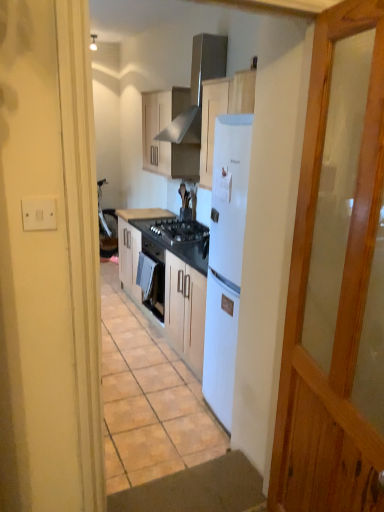
Identify the location of black laminate countertop at center, positioned as the 2th countertop in bottom-to-top order. This screenshot has width=384, height=512. (143, 213).

The image size is (384, 512). Find the location of `black glass gas stove at center`. black glass gas stove at center is located at coordinates (180, 231).

You are a GUI agent. You are given a task and a screenshot of the screen. Output one action in this format:
    pyautogui.click(x=<x>, y=<y>)
    Task: Click on the black laminate countertop at center, positioned as the 2th countertop in bottom-to-top order
    Image resolution: width=384 pixels, height=512 pixels.
    Given the screenshot: What is the action you would take?
    pyautogui.click(x=143, y=213)

Would you consider matte wood cabinets at center to be distant from black granite countertop at center, positioned as the 2th countertop in top-to-bottom order?

No, matte wood cabinets at center is not far from black granite countertop at center, positioned as the 2th countertop in top-to-bottom order.

From the image's perspective, is matte wood cabinets at center on black granite countertop at center, positioned as the 2th countertop in top-to-bottom order?

Yes, from the image's perspective, matte wood cabinets at center is over black granite countertop at center, positioned as the 2th countertop in top-to-bottom order.

Can you tell me how much matte wood cabinets at center and black granite countertop at center, the first countertop when ordered from bottom to top, differ in facing direction?

matte wood cabinets at center and black granite countertop at center, the first countertop when ordered from bottom to top, are facing 1.15 degrees away from each other.

Considering the points (172, 170) and (149, 228), which point is in front, point (172, 170) or point (149, 228)?

The point (172, 170) is closer to the camera.

Considering the sizes of objects black granite countertop at center, the first countertop when ordered from bottom to top, and stainless steel exhaust hood at upper center in the image provided, who is thinner, black granite countertop at center, the first countertop when ordered from bottom to top, or stainless steel exhaust hood at upper center?

Thinner between the two is stainless steel exhaust hood at upper center.

From a real-world perspective, is black granite countertop at center, the first countertop when ordered from bottom to top, on top of stainless steel exhaust hood at upper center?

Actually, black granite countertop at center, the first countertop when ordered from bottom to top, is physically below stainless steel exhaust hood at upper center in the real world.

This screenshot has height=512, width=384. Find the location of `exhaust hood in front of the black granite countertop at center, positioned as the 2th countertop in top-to-bottom order`. exhaust hood in front of the black granite countertop at center, positioned as the 2th countertop in top-to-bottom order is located at coordinates 197,88.

Considering the relative sizes of black granite countertop at center, positioned as the 2th countertop in top-to-bottom order, and stainless steel exhaust hood at upper center in the image provided, is black granite countertop at center, positioned as the 2th countertop in top-to-bottom order, shorter than stainless steel exhaust hood at upper center?

Indeed, black granite countertop at center, positioned as the 2th countertop in top-to-bottom order, has a lesser height compared to stainless steel exhaust hood at upper center.

This screenshot has height=512, width=384. In the image, there is a black laminate countertop at center, positioned as the 2th countertop in bottom-to-top order. In order to click on countertop below it (from a real-world perspective) in this screenshot , I will do `click(176, 237)`.

Is point (156, 209) farther from camera compared to point (135, 218)?

Yes, it is behind point (135, 218).

In the scene shown: Considering the sizes of objects black granite countertop at center, the first countertop when ordered from bottom to top, and black laminate countertop at center, positioned as the 2th countertop in bottom-to-top order, in the image provided, who is bigger, black granite countertop at center, the first countertop when ordered from bottom to top, or black laminate countertop at center, positioned as the 2th countertop in bottom-to-top order,?

black granite countertop at center, the first countertop when ordered from bottom to top.

Is black granite countertop at center, positioned as the 2th countertop in top-to-bottom order, oriented away from black laminate countertop at center, which is counted as the 1th countertop, starting from the top?

No, black granite countertop at center, positioned as the 2th countertop in top-to-bottom order,'s orientation is not away from black laminate countertop at center, which is counted as the 1th countertop, starting from the top.

Does matte wood cabinets at center have a lesser width compared to stainless steel exhaust hood at upper center?

Yes, matte wood cabinets at center is thinner than stainless steel exhaust hood at upper center.

From the image's perspective, which is above, matte wood cabinets at center or stainless steel exhaust hood at upper center?

stainless steel exhaust hood at upper center is shown above in the image.

Is stainless steel exhaust hood at upper center at the back of matte wood cabinets at center?

matte wood cabinets at center does not have its back to stainless steel exhaust hood at upper center.

Is the position of matte wood cabinets at center less distant than that of stainless steel exhaust hood at upper center?

No, it is not.

Looking at this image, considering the positions of objects black granite countertop at center, the first countertop when ordered from bottom to top, and white plastic switch at upper left in the image provided, who is more to the left, black granite countertop at center, the first countertop when ordered from bottom to top, or white plastic switch at upper left?

white plastic switch at upper left.

In terms of height, does black granite countertop at center, the first countertop when ordered from bottom to top, look taller or shorter compared to white plastic switch at upper left?

black granite countertop at center, the first countertop when ordered from bottom to top, is taller than white plastic switch at upper left.

Is white plastic switch at upper left at the back of black granite countertop at center, positioned as the 2th countertop in top-to-bottom order?

That's not correct — black granite countertop at center, positioned as the 2th countertop in top-to-bottom order, is not looking away from white plastic switch at upper left.

How distant is black granite countertop at center, positioned as the 2th countertop in top-to-bottom order, from white plastic switch at upper left?

black granite countertop at center, positioned as the 2th countertop in top-to-bottom order, and white plastic switch at upper left are 2.38 meters apart from each other.

Is stainless steel exhaust hood at upper center touching matte wood cabinets at center?

No, stainless steel exhaust hood at upper center is not touching matte wood cabinets at center.

Can we say stainless steel exhaust hood at upper center lies outside matte wood cabinets at center?

Absolutely, stainless steel exhaust hood at upper center is external to matte wood cabinets at center.

From the image's perspective, does stainless steel exhaust hood at upper center appear lower than matte wood cabinets at center?

No, from the image's perspective, stainless steel exhaust hood at upper center is not beneath matte wood cabinets at center.

Who is shorter, stainless steel exhaust hood at upper center or matte wood cabinets at center?

matte wood cabinets at center is shorter.

Is black laminate countertop at center, positioned as the 2th countertop in bottom-to-top order, at the back of white plastic switch at upper left?

white plastic switch at upper left is not turned away from black laminate countertop at center, positioned as the 2th countertop in bottom-to-top order.

Is white plastic switch at upper left positioned in front of black laminate countertop at center, positioned as the 2th countertop in bottom-to-top order?

Yes, the depth of white plastic switch at upper left is less than that of black laminate countertop at center, positioned as the 2th countertop in bottom-to-top order.

Are white plastic switch at upper left and black laminate countertop at center, positioned as the 2th countertop in bottom-to-top order, located far from each other?

white plastic switch at upper left is far away from black laminate countertop at center, positioned as the 2th countertop in bottom-to-top order.

The image size is (384, 512). What are the coordinates of `cabinetry that appears on the right of black granite countertop at center, the first countertop when ordered from bottom to top` in the screenshot? It's located at (168, 141).

The height and width of the screenshot is (512, 384). I want to click on the 2nd countertop located beneath the stainless steel exhaust hood at upper center (from a real-world perspective), so click(176, 237).

Looking at the image, which one is located closer to stainless steel exhaust hood at upper center, black glass gas stove at center or black laminate countertop at center, which is counted as the 1th countertop, starting from the top?

black glass gas stove at center is closer to stainless steel exhaust hood at upper center.

When comparing their distances from black granite countertop at center, the first countertop when ordered from bottom to top, does matte wood cabinets at center or black glass gas stove at center seem closer?

black glass gas stove at center is closer to black granite countertop at center, the first countertop when ordered from bottom to top.

Looking at the image, which one is located further to white plastic switch at upper left, black granite countertop at center, the first countertop when ordered from bottom to top, or black laminate countertop at center, which is counted as the 1th countertop, starting from the top?

The object further to white plastic switch at upper left is black laminate countertop at center, which is counted as the 1th countertop, starting from the top.

Looking at the image, which one is located closer to matte wood cabinets at center, black granite countertop at center, positioned as the 2th countertop in top-to-bottom order, or black laminate countertop at center, positioned as the 2th countertop in bottom-to-top order?

Based on the image, black granite countertop at center, positioned as the 2th countertop in top-to-bottom order, appears to be nearer to matte wood cabinets at center.

Estimate the real-world distances between objects in this image. Which object is closer to black glass gas stove at center, matte wood cabinets at center or black granite countertop at center, the first countertop when ordered from bottom to top?

The object closer to black glass gas stove at center is black granite countertop at center, the first countertop when ordered from bottom to top.

Considering their positions, is matte wood cabinets at center positioned further to black laminate countertop at center, which is counted as the 1th countertop, starting from the top, than black glass gas stove at center?

Among the two, matte wood cabinets at center is located further to black laminate countertop at center, which is counted as the 1th countertop, starting from the top.

Considering their positions, is black laminate countertop at center, which is counted as the 1th countertop, starting from the top, positioned further to matte wood cabinets at center than stainless steel exhaust hood at upper center?

black laminate countertop at center, which is counted as the 1th countertop, starting from the top, is positioned further to the anchor matte wood cabinets at center.

From the image, which object appears to be farther from black laminate countertop at center, positioned as the 2th countertop in bottom-to-top order, stainless steel exhaust hood at upper center or matte wood cabinets at center?

Based on the image, stainless steel exhaust hood at upper center appears to be further to black laminate countertop at center, positioned as the 2th countertop in bottom-to-top order.

The width and height of the screenshot is (384, 512). Find the location of `gas stove between white plastic switch at upper left and black granite countertop at center, the first countertop when ordered from bottom to top, along the z-axis`. gas stove between white plastic switch at upper left and black granite countertop at center, the first countertop when ordered from bottom to top, along the z-axis is located at coordinates (180, 231).

Where is `gas stove between white plastic switch at upper left and matte wood cabinets at center from front to back`? gas stove between white plastic switch at upper left and matte wood cabinets at center from front to back is located at coordinates (180, 231).

Identify the location of exhaust hood between white plastic switch at upper left and black granite countertop at center, the first countertop when ordered from bottom to top, along the z-axis. (197, 88).

Identify the location of cabinetry between stainless steel exhaust hood at upper center and black glass gas stove at center in the vertical direction. (168, 141).